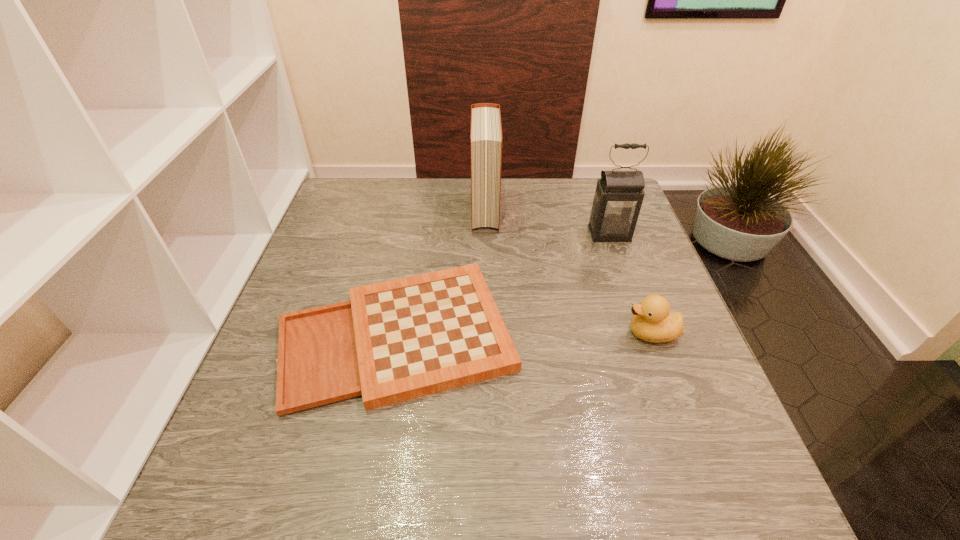
Locate an element on the screen. vacant point that satisfies the following two spatial constraints: 1. facing forward on the third tallest object; 2. on the front side of the gameboard is located at coordinates (652, 334).